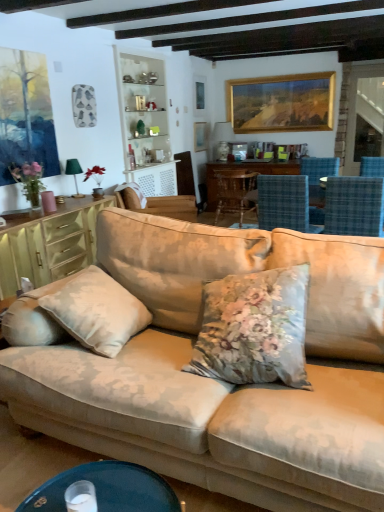
Describe the element at coordinates (130, 158) in the screenshot. I see `matte black phone at center` at that location.

Find the location of a particular element. This screenshot has height=512, width=384. wooden table at center is located at coordinates (248, 169).

How much space does blue plaid chair at right, marked as the 4th chair in a back-to-front arrangement, occupy vertically?

blue plaid chair at right, marked as the 4th chair in a back-to-front arrangement, is 22.88 inches tall.

Describe the element at coordinates (354, 206) in the screenshot. I see `blue plaid chair at right, marked as the 4th chair in a back-to-front arrangement` at that location.

How much space does beige fabric chair at center, marked as the third chair in a front-to-back arrangement, occupy vertically?

21.78 inches.

Identify the location of beige fabric chair at center, marked as the third chair in a front-to-back arrangement. This screenshot has width=384, height=512. (160, 205).

What is the approximate height of matte green cabinet at left?

29.84 inches.

Measure the distance between matte green cabinet at left and camera.

matte green cabinet at left and camera are 2.84 meters apart from each other.

What do you see at coordinates (285, 203) in the screenshot? I see `blue plaid chair at center, which ranks as the third chair in back-to-front order` at bounding box center [285, 203].

At what (x,y) coordinates should I click in order to perform the action: click on matte black phone at center. Please return your answer as a coordinate pair (x, y). The image size is (384, 512). Looking at the image, I should click on 130,158.

The height and width of the screenshot is (512, 384). Identify the location of chair that appears in front of the blue plaid chair at center, marked as the second chair in a front-to-back arrangement. (354, 206).

Is blue plaid chair at center, marked as the second chair in a front-to-back arrangement, positioned far away from blue plaid chair at right, marked as the 4th chair in a back-to-front arrangement?

That's not correct — blue plaid chair at center, marked as the second chair in a front-to-back arrangement, is a little close to blue plaid chair at right, marked as the 4th chair in a back-to-front arrangement.

Is point (301, 183) positioned behind point (369, 227)?

Yes, it is.

Locate an element on the screen. This screenshot has height=512, width=384. the 1st chair in front of the wooden picture frame at upper center, the 2th picture frame when ordered from right to left, counting from the anchor's position is located at coordinates (236, 192).

Do you think wooden picture frame at upper center, which is the first picture frame in left-to-right order, is within wooden chair at center, which appears as the fourth chair when viewed from the front, or outside of it?

wooden picture frame at upper center, which is the first picture frame in left-to-right order, is located beyond the bounds of wooden chair at center, which appears as the fourth chair when viewed from the front.

Considering their positions, is wooden picture frame at upper center, the 2th picture frame when ordered from right to left, located in front of or behind wooden chair at center, which is the 1th chair from back to front?

Visually, wooden picture frame at upper center, the 2th picture frame when ordered from right to left, is located behind wooden chair at center, which is the 1th chair from back to front.

Measure the distance between beige fabric chair at center, the 2th chair positioned from the back, and matte black phone at center.

beige fabric chair at center, the 2th chair positioned from the back, is 33.15 inches from matte black phone at center.

From the image's perspective, between beige fabric chair at center, the 2th chair positioned from the back, and matte black phone at center, who is located below?

beige fabric chair at center, the 2th chair positioned from the back, is shown below in the image.

Could you tell me if beige fabric chair at center, the 2th chair positioned from the back, is turned towards matte black phone at center?

No, beige fabric chair at center, the 2th chair positioned from the back, is not turned towards matte black phone at center.

Does beige fabric chair at center, the 2th chair positioned from the back, appear on the left side of matte black phone at center?

In fact, beige fabric chair at center, the 2th chair positioned from the back, is to the right of matte black phone at center.

Consider the image. Can you confirm if pink matte vase at left is thinner than green fabric lampshade at left?

Incorrect, the width of pink matte vase at left is not less than that of green fabric lampshade at left.

Considering the sizes of objects pink matte vase at left and green fabric lampshade at left in the image provided, who is smaller, pink matte vase at left or green fabric lampshade at left?

green fabric lampshade at left.

From the image's perspective, who appears lower, pink matte vase at left or green fabric lampshade at left?

pink matte vase at left is shown below in the image.

Is pink matte vase at left facing towards green fabric lampshade at left?

No, pink matte vase at left is not oriented towards green fabric lampshade at left.

Does beige fabric couch at center have a smaller size compared to blue plaid chair at center, marked as the second chair in a front-to-back arrangement?

→ Incorrect, beige fabric couch at center is not smaller in size than blue plaid chair at center, marked as the second chair in a front-to-back arrangement.

From a real-world perspective, who is located higher, beige fabric couch at center or blue plaid chair at center, marked as the second chair in a front-to-back arrangement?

blue plaid chair at center, marked as the second chair in a front-to-back arrangement, is physically above.

From a real-world perspective, which chair is the 2nd one above the beige fabric couch at center? Please provide its 2D coordinates.

[(285, 203)]

Is beige fabric couch at center not inside blue plaid chair at center, which ranks as the third chair in back-to-front order?

Yes.

From a real-world perspective, is beige fabric couch at center positioned under matte green cabinet at left based on gravity?

Actually, beige fabric couch at center is physically above matte green cabinet at left in the real world.

At what (x,y) coordinates should I click in order to perform the action: click on cabinetry on the left of beige fabric couch at center. Please return your answer as a coordinate pair (x, y). The height and width of the screenshot is (512, 384). Looking at the image, I should click on (49, 244).

How far apart are beige fabric couch at center and matte green cabinet at left?

1.45 meters.

Considering the sizes of beige fabric couch at center and matte green cabinet at left in the image, is beige fabric couch at center wider or thinner than matte green cabinet at left?

Considering their sizes, beige fabric couch at center looks broader than matte green cabinet at left.

Is blue glossy tray at lower center far from blue plaid chair at center, marked as the second chair in a front-to-back arrangement?

Yes, blue glossy tray at lower center is far from blue plaid chair at center, marked as the second chair in a front-to-back arrangement.

Is blue glossy tray at lower center facing towards blue plaid chair at center, which ranks as the third chair in back-to-front order?

Yes.

From a real-world perspective, who is located higher, blue glossy tray at lower center or blue plaid chair at center, which ranks as the third chair in back-to-front order?

blue plaid chair at center, which ranks as the third chair in back-to-front order, is physically above.

From a real-world perspective, count 1st chairs downward from the blue plaid chair at right, acting as the 1th chair starting from the front, and point to it. Please provide its 2D coordinates.

[(285, 203)]

From the image's perspective, starting from the wooden chair at center, which is the 1th chair from back to front, which picture frame is the 1st one above? Please provide its 2D coordinates.

[(200, 136)]

Consider the image. From the image, which object appears to be farther from gold-framed painting at upper center, which is the 1th picture frame from right to left, blue plaid chair at right, acting as the 1th chair starting from the front, or green fabric lampshade at left?

Based on the image, green fabric lampshade at left appears to be further to gold-framed painting at upper center, which is the 1th picture frame from right to left.

Looking at the image, which one is located closer to blue plaid chair at center, marked as the second chair in a front-to-back arrangement, wooden picture frame at upper center, the 2th picture frame when ordered from right to left, or beige fabric chair at center, marked as the third chair in a front-to-back arrangement?

beige fabric chair at center, marked as the third chair in a front-to-back arrangement, lies closer to blue plaid chair at center, marked as the second chair in a front-to-back arrangement, than the other object.

Which object lies further to the anchor point pink matte vase at left, beige fabric couch at center or blue glossy tray at lower center?

The object further to pink matte vase at left is blue glossy tray at lower center.

Estimate the real-world distances between objects in this image. Which object is closer to beige fabric chair at center, the 2th chair positioned from the back, wooden chair at center, which is the 1th chair from back to front, or wooden table at center?

wooden chair at center, which is the 1th chair from back to front, is closer to beige fabric chair at center, the 2th chair positioned from the back.

Looking at the image, which one is located further to beige fabric chair at center, the 2th chair positioned from the back, beige fabric couch at center or wooden table at center?

beige fabric couch at center lies further to beige fabric chair at center, the 2th chair positioned from the back, than the other object.

Considering their positions, is wooden table at center positioned further to matte black phone at center than blue plaid chair at right, marked as the 4th chair in a back-to-front arrangement?

blue plaid chair at right, marked as the 4th chair in a back-to-front arrangement, is further to matte black phone at center.

Looking at the image, which one is located further to pink matte vase at left, beige fabric chair at center, marked as the third chair in a front-to-back arrangement, or wooden picture frame at upper center, the 2th picture frame when ordered from right to left?

Result: wooden picture frame at upper center, the 2th picture frame when ordered from right to left, is positioned further to the anchor pink matte vase at left.

Estimate the real-world distances between objects in this image. Which object is closer to matte black phone at center, wooden picture frame at upper center, the 2th picture frame when ordered from right to left, or wooden table at center?

wooden picture frame at upper center, the 2th picture frame when ordered from right to left, lies closer to matte black phone at center than the other object.

The width and height of the screenshot is (384, 512). I want to click on lamp positioned between blue plaid chair at right, acting as the 1th chair starting from the front, and wooden table at center from near to far, so click(74, 174).

Locate an element on the screen. lamp located between blue glossy tray at lower center and beige fabric chair at center, marked as the third chair in a front-to-back arrangement, in the depth direction is located at coordinates (74, 174).

Locate an element on the screen. The height and width of the screenshot is (512, 384). corded phone positioned between matte green cabinet at left and wooden chair at center, which appears as the fourth chair when viewed from the front, from near to far is located at coordinates (130, 158).

Find the location of a particular element. The height and width of the screenshot is (512, 384). flower between blue plaid chair at right, marked as the 4th chair in a back-to-front arrangement, and wooden picture frame at upper center, the 2th picture frame when ordered from right to left, from front to back is located at coordinates (29, 180).